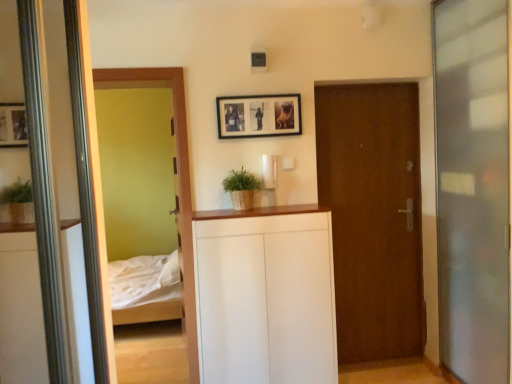
Question: Can you confirm if white matte cabinet at center is bigger than transparent glass screen door at right?

Choices:
 (A) yes
 (B) no

Answer: (A)

Question: From the image's perspective, is white matte cabinet at center under transparent glass screen door at right?

Choices:
 (A) yes
 (B) no

Answer: (A)

Question: From a real-world perspective, is white matte cabinet at center located higher than transparent glass screen door at right?

Choices:
 (A) yes
 (B) no

Answer: (B)

Question: Is white matte cabinet at center facing towards transparent glass screen door at right?

Choices:
 (A) yes
 (B) no

Answer: (B)

Question: Is white matte cabinet at center taller than transparent glass screen door at right?

Choices:
 (A) no
 (B) yes

Answer: (A)

Question: Is the position of white matte cabinet at center more distant than that of transparent glass screen door at right?

Choices:
 (A) no
 (B) yes

Answer: (B)

Question: Is black matte picture frame at upper center in front of brown wooden door at center?

Choices:
 (A) yes
 (B) no

Answer: (A)

Question: From the image's perspective, is black matte picture frame at upper center located beneath brown wooden door at center?

Choices:
 (A) no
 (B) yes

Answer: (A)

Question: Is black matte picture frame at upper center outside of brown wooden door at center?

Choices:
 (A) no
 (B) yes

Answer: (B)

Question: Would you say brown wooden door at center is part of black matte picture frame at upper center's contents?

Choices:
 (A) yes
 (B) no

Answer: (B)

Question: Does black matte picture frame at upper center have a lesser height compared to brown wooden door at center?

Choices:
 (A) no
 (B) yes

Answer: (B)

Question: Considering the relative positions of black matte picture frame at upper center and brown wooden door at center in the image provided, is black matte picture frame at upper center to the right of brown wooden door at center from the viewer's perspective?

Choices:
 (A) no
 (B) yes

Answer: (A)

Question: From the image's perspective, would you say white matte cabinet at center is positioned over braided straw plant at center?

Choices:
 (A) no
 (B) yes

Answer: (A)